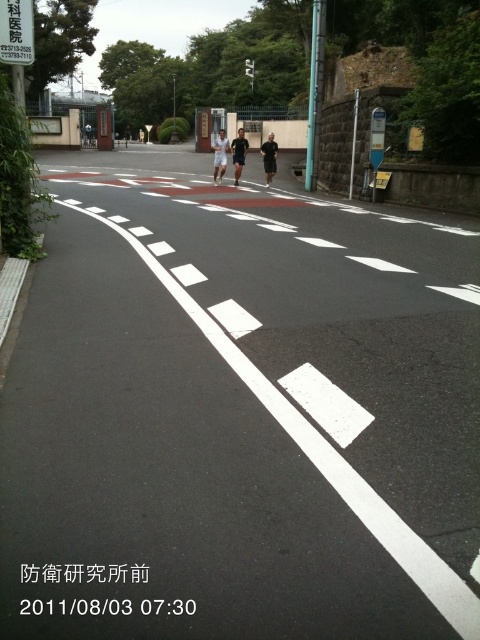
Question: Estimate the real-world distances between objects in this image. Which object is closer to the black matte shirt at center?

Choices:
 (A) white matte shirt at center
 (B) white plastic sign at upper left
 (C) dark blue fabric shirt at center

Answer: (C)

Question: Is white matte shirt at center to the left of black matte shirt at center from the viewer's perspective?

Choices:
 (A) yes
 (B) no

Answer: (A)

Question: Is dark blue fabric shirt at center closer to the viewer compared to black matte shirt at center?

Choices:
 (A) no
 (B) yes

Answer: (B)

Question: Which point is closer to the camera?

Choices:
 (A) (219, 170)
 (B) (240, 168)
 (C) (22, 8)

Answer: (C)

Question: Does white plastic sign at upper left have a lesser width compared to black matte shirt at center?

Choices:
 (A) yes
 (B) no

Answer: (B)

Question: Which of the following is the farthest from the observer?

Choices:
 (A) white plastic sign at upper left
 (B) white matte shirt at center
 (C) dark blue fabric shirt at center
 (D) black matte shirt at center

Answer: (D)